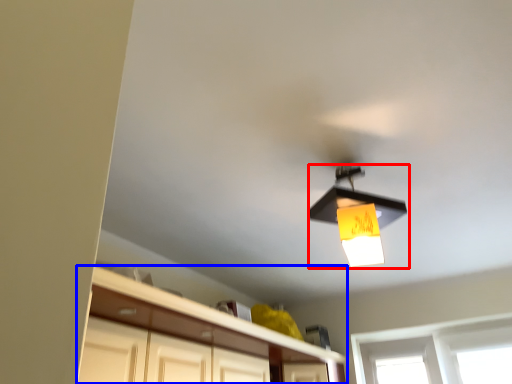
Question: Which object is closer to the camera taking this photo, lamp (highlighted by a red box) or cabinetry (highlighted by a blue box)?

Choices:
 (A) lamp
 (B) cabinetry

Answer: (B)